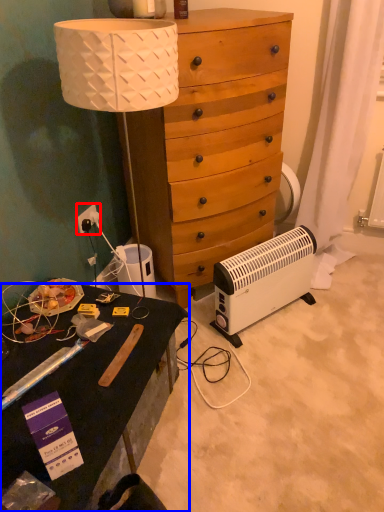
Question: Which object appears closest to the camera in this image, power outlet (highlighted by a red box) or desk (highlighted by a blue box)?

Choices:
 (A) power outlet
 (B) desk

Answer: (B)